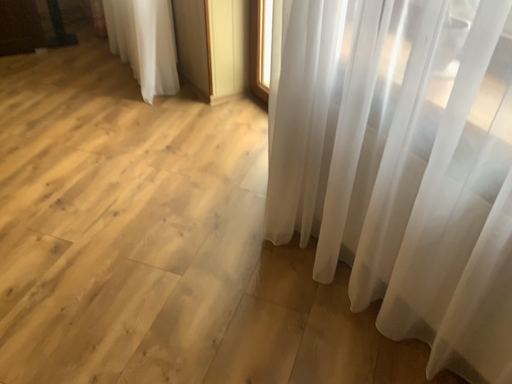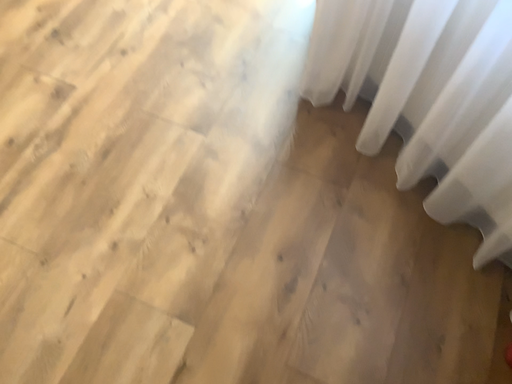
Question: How did the camera likely rotate when shooting the video?

Choices:
 (A) rotated downward
 (B) rotated upward

Answer: (A)